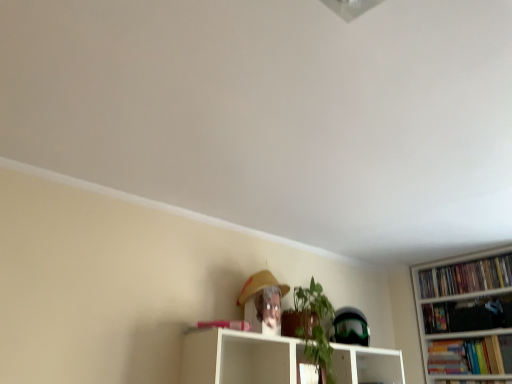
The image size is (512, 384). I want to click on hardcover book at right, arranged as the second book when viewed from the top, so click(471, 356).

Measure the distance between hardcover books at right, the 2th book in the bottom-to-top sequence, and camera.

hardcover books at right, the 2th book in the bottom-to-top sequence, and camera are 7.94 feet apart from each other.

What do you see at coordinates (239, 358) in the screenshot?
I see `white glossy shelf at center` at bounding box center [239, 358].

The image size is (512, 384). What are the coordinates of `white glossy shelf at center` in the screenshot? It's located at (239, 358).

Where is `matte yellow straw hat at upper center`? This screenshot has height=384, width=512. matte yellow straw hat at upper center is located at coordinates (263, 302).

Identify the location of hardcover book at right, arranged as the second book when viewed from the top. This screenshot has height=384, width=512. (471, 356).

From the picture: From the image's perspective, relative to matte yellow straw hat at upper center, is hardcover book at right, the first book when ordered from bottom to top, above or below?

Clearly, from the image's perspective, hardcover book at right, the first book when ordered from bottom to top, is below matte yellow straw hat at upper center.

There is a matte yellow straw hat at upper center. Identify the location of the 2nd book below it (from the image's perspective). The width and height of the screenshot is (512, 384). (471, 356).

From a real-world perspective, is hardcover book at right, the first book when ordered from bottom to top, below matte yellow straw hat at upper center?

Yes, from a real-world perspective, hardcover book at right, the first book when ordered from bottom to top, is below matte yellow straw hat at upper center.

Is point (489, 288) positioned after point (259, 312)?

Yes, it is.

Is hardcover books at right, the 2th book in the bottom-to-top sequence, with matte yellow straw hat at upper center?

No, hardcover books at right, the 2th book in the bottom-to-top sequence, is not making contact with matte yellow straw hat at upper center.

Looking at this image, which object is positioned more to the left, hardcover books at right, the 2th book in the bottom-to-top sequence, or matte yellow straw hat at upper center?

matte yellow straw hat at upper center is more to the left.

Consider the image. In terms of size, does hardcover books at right, arranged as the first book when viewed from the top, appear bigger or smaller than matte yellow straw hat at upper center?

hardcover books at right, arranged as the first book when viewed from the top, is smaller than matte yellow straw hat at upper center.

Is white glossy shelf at center far away from matte yellow straw hat at upper center?

That's not correct — white glossy shelf at center is a little close to matte yellow straw hat at upper center.

You are a GUI agent. You are given a task and a screenshot of the screen. Output one action in this format:
    pyautogui.click(x=<x>, y=<y>)
    Task: Click on the person that is behind the white glossy shelf at center
    The height and width of the screenshot is (384, 512).
    Given the screenshot: What is the action you would take?
    pyautogui.click(x=263, y=302)

What's the angular difference between white glossy shelf at center and matte yellow straw hat at upper center's facing directions?

The angle between the facing direction of white glossy shelf at center and the facing direction of matte yellow straw hat at upper center is 2.9 degrees.

Is white glossy shelf at center to the right of matte yellow straw hat at upper center from the viewer's perspective?

Yes, white glossy shelf at center is to the right of matte yellow straw hat at upper center.

Can you confirm if hardcover books at right, the 2th book in the bottom-to-top sequence, is shorter than white glossy shelf at center?

Yes.

Is point (493, 271) positioned after point (260, 346)?

Yes, point (493, 271) is behind point (260, 346).

Is hardcover books at right, the 2th book in the bottom-to-top sequence, outside of white glossy shelf at center?

That's correct, hardcover books at right, the 2th book in the bottom-to-top sequence, is outside of white glossy shelf at center.

Locate an element on the screen. The height and width of the screenshot is (384, 512). shelf below the hardcover books at right, the 2th book in the bottom-to-top sequence (from the image's perspective) is located at coordinates (239, 358).

From the picture: Is hardcover books at right, the 2th book in the bottom-to-top sequence, located outside hardcover book at right, arranged as the second book when viewed from the top?

Yes, hardcover books at right, the 2th book in the bottom-to-top sequence, is located beyond the bounds of hardcover book at right, arranged as the second book when viewed from the top.

In the image, there is a hardcover books at right, the 2th book in the bottom-to-top sequence. Find the location of `book below it (from a real-world perspective)`. book below it (from a real-world perspective) is located at coordinates click(471, 356).

Considering the relative positions of hardcover books at right, arranged as the first book when viewed from the top, and hardcover book at right, the first book when ordered from bottom to top, in the image provided, is hardcover books at right, arranged as the first book when viewed from the top, to the left or to the right of hardcover book at right, the first book when ordered from bottom to top,?

Clearly, hardcover books at right, arranged as the first book when viewed from the top, is on the left of hardcover book at right, the first book when ordered from bottom to top, in the image.

Between matte yellow straw hat at upper center and white glossy shelf at center, which one has less height?

Standing shorter between the two is white glossy shelf at center.

Could you tell me if matte yellow straw hat at upper center is turned towards white glossy shelf at center?

No, matte yellow straw hat at upper center is not facing towards white glossy shelf at center.

How different are the orientations of matte yellow straw hat at upper center and white glossy shelf at center in degrees?

matte yellow straw hat at upper center and white glossy shelf at center are facing 2.9 degrees away from each other.

Locate an element on the screen. The width and height of the screenshot is (512, 384). shelf in front of the matte yellow straw hat at upper center is located at coordinates (239, 358).

Considering the relative positions of hardcover book at right, the first book when ordered from bottom to top, and hardcover books at right, arranged as the first book when viewed from the top, in the image provided, is hardcover book at right, the first book when ordered from bottom to top, behind hardcover books at right, arranged as the first book when viewed from the top,?

That is False.

From a real-world perspective, is hardcover book at right, the first book when ordered from bottom to top, under hardcover books at right, the 2th book in the bottom-to-top sequence?

Indeed, from a real-world perspective, hardcover book at right, the first book when ordered from bottom to top, is positioned beneath hardcover books at right, the 2th book in the bottom-to-top sequence.

From the image's perspective, does hardcover book at right, arranged as the second book when viewed from the top, appear lower than hardcover books at right, the 2th book in the bottom-to-top sequence?

Yes, from the image's perspective, hardcover book at right, arranged as the second book when viewed from the top, is beneath hardcover books at right, the 2th book in the bottom-to-top sequence.

In order to click on person above the hardcover book at right, the first book when ordered from bottom to top (from a real-world perspective) in this screenshot , I will do `click(263, 302)`.

The height and width of the screenshot is (384, 512). I want to click on person directly beneath the hardcover books at right, the 2th book in the bottom-to-top sequence (from a real-world perspective), so click(263, 302).

In the scene shown: When comparing their distances from hardcover book at right, arranged as the second book when viewed from the top, does white glossy shelf at center or matte yellow straw hat at upper center seem closer?

Among the two, white glossy shelf at center is located nearer to hardcover book at right, arranged as the second book when viewed from the top.

Looking at this image, considering their positions, is hardcover book at right, the first book when ordered from bottom to top, positioned closer to white glossy shelf at center than matte yellow straw hat at upper center?

matte yellow straw hat at upper center is closer to white glossy shelf at center.

Which object lies further to the anchor point hardcover book at right, arranged as the second book when viewed from the top, matte yellow straw hat at upper center or hardcover books at right, the 2th book in the bottom-to-top sequence?

matte yellow straw hat at upper center is further to hardcover book at right, arranged as the second book when viewed from the top.

Based on their spatial positions, is hardcover books at right, arranged as the first book when viewed from the top, or white glossy shelf at center further from matte yellow straw hat at upper center?

Among the two, hardcover books at right, arranged as the first book when viewed from the top, is located further to matte yellow straw hat at upper center.

From the image, which object appears to be farther from hardcover book at right, the first book when ordered from bottom to top, hardcover books at right, the 2th book in the bottom-to-top sequence, or matte yellow straw hat at upper center?

matte yellow straw hat at upper center.

Considering their positions, is matte yellow straw hat at upper center positioned closer to white glossy shelf at center than hardcover books at right, the 2th book in the bottom-to-top sequence?

matte yellow straw hat at upper center is closer to white glossy shelf at center.

Which object lies nearer to the anchor point hardcover book at right, arranged as the second book when viewed from the top, matte yellow straw hat at upper center or white glossy shelf at center?

white glossy shelf at center is closer to hardcover book at right, arranged as the second book when viewed from the top.

When comparing their distances from white glossy shelf at center, does hardcover books at right, the 2th book in the bottom-to-top sequence, or matte yellow straw hat at upper center seem closer?

matte yellow straw hat at upper center is closer to white glossy shelf at center.

Image resolution: width=512 pixels, height=384 pixels. Find the location of `shelf situated between matte yellow straw hat at upper center and hardcover book at right, the first book when ordered from bottom to top, from left to right`. shelf situated between matte yellow straw hat at upper center and hardcover book at right, the first book when ordered from bottom to top, from left to right is located at coordinates (239, 358).

At what (x,y) coordinates should I click in order to perform the action: click on shelf situated between matte yellow straw hat at upper center and hardcover books at right, the 2th book in the bottom-to-top sequence, from left to right. Please return your answer as a coordinate pair (x, y). The height and width of the screenshot is (384, 512). Looking at the image, I should click on (239, 358).

Locate an element on the screen. This screenshot has width=512, height=384. book situated between matte yellow straw hat at upper center and hardcover book at right, the first book when ordered from bottom to top, from left to right is located at coordinates (466, 277).

The width and height of the screenshot is (512, 384). Identify the location of book located between white glossy shelf at center and hardcover book at right, arranged as the second book when viewed from the top, in the left-right direction. (466, 277).